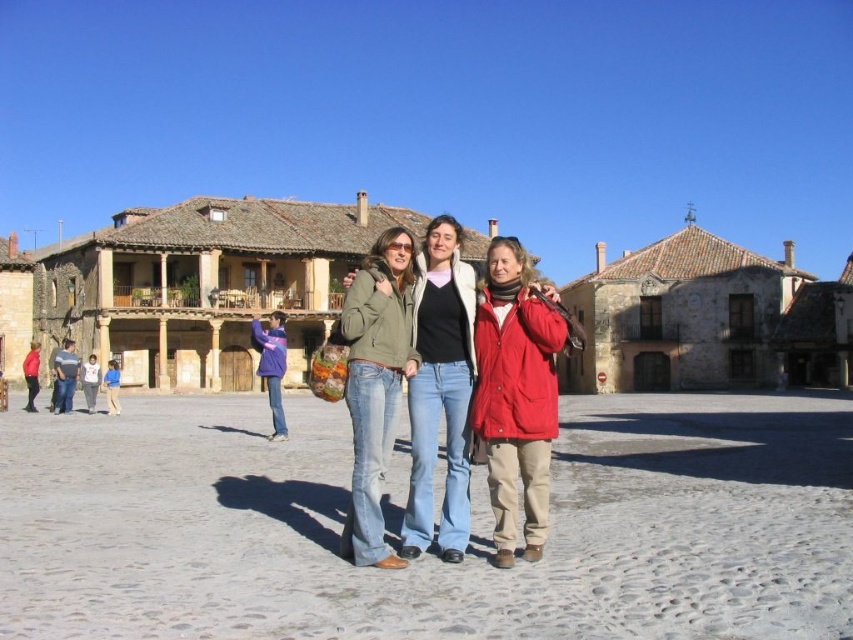
Can you confirm if matte red jacket at center is positioned to the left of purple fleece jacket at lower left?

Incorrect, matte red jacket at center is not on the left side of purple fleece jacket at lower left.

Can you confirm if matte red jacket at center is positioned to the right of purple fleece jacket at lower left?

Yes, matte red jacket at center is to the right of purple fleece jacket at lower left.

What do you see at coordinates (515, 394) in the screenshot? The width and height of the screenshot is (853, 640). I see `matte red jacket at center` at bounding box center [515, 394].

In order to click on matte red jacket at center in this screenshot , I will do `click(515, 394)`.

Which is more to the right, matte red jacket at center or blue denim jeans at lower left?

matte red jacket at center is more to the right.

Does point (497, 248) come behind point (112, 368)?

No, it is not.

I want to click on matte red jacket at center, so click(x=515, y=394).

Which of these two, matte black jacket at center or matte green jacket at center, stands shorter?

With less height is matte green jacket at center.

Between matte black jacket at center and matte green jacket at center, which one appears on the right side from the viewer's perspective?

matte green jacket at center

Which is behind, point (432, 353) or point (352, 554)?

The point (432, 353) is behind.

Image resolution: width=853 pixels, height=640 pixels. I want to click on matte black jacket at center, so click(x=440, y=392).